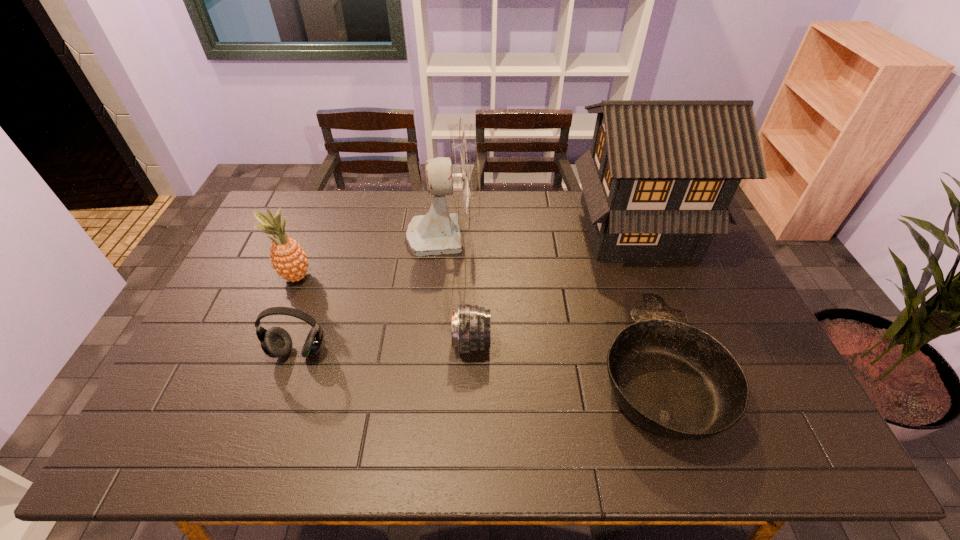
In order to click on free region located at the front element of the telephoto lens in this screenshot , I will do `click(573, 342)`.

Where is `vacant space located 0.260m with the handle extending from the side of the frying pan`? vacant space located 0.260m with the handle extending from the side of the frying pan is located at coordinates (617, 251).

The height and width of the screenshot is (540, 960). I want to click on vacant space situated with the handle extending from the side of the frying pan, so [x=631, y=293].

You are a GUI agent. You are given a task and a screenshot of the screen. Output one action in this format:
    pyautogui.click(x=<x>, y=<y>)
    Task: Click on the vacant region located with the handle extending from the side of the frying pan
    
    Given the screenshot: What is the action you would take?
    pyautogui.click(x=621, y=263)

I want to click on dollhouse that is at the far edge, so click(x=657, y=182).

Identify the location of fan that is positioned at the far edge. This screenshot has height=540, width=960. (437, 233).

This screenshot has width=960, height=540. In order to click on object at the near edge in this screenshot , I will do 676,381.

You are a GUI agent. You are given a task and a screenshot of the screen. Output one action in this format:
    pyautogui.click(x=<x>, y=<y>)
    Task: Click on the object present at the left edge
    This screenshot has width=960, height=540.
    Given the screenshot: What is the action you would take?
    pyautogui.click(x=289, y=260)

Locate an element on the screen. dollhouse at the right edge is located at coordinates (657, 182).

Image resolution: width=960 pixels, height=540 pixels. I want to click on frying pan that is positioned at the right edge, so [676, 381].